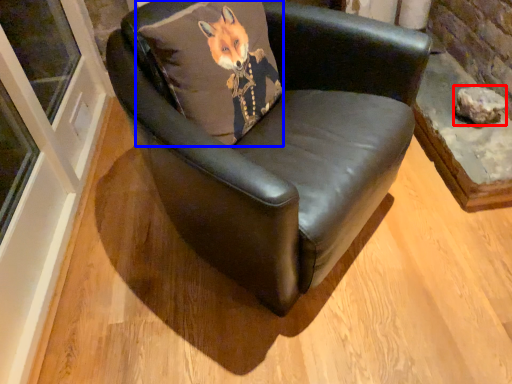
Question: Which object appears farthest to the camera in this image, stone (highlighted by a red box) or pillow (highlighted by a blue box)?

Choices:
 (A) stone
 (B) pillow

Answer: (A)